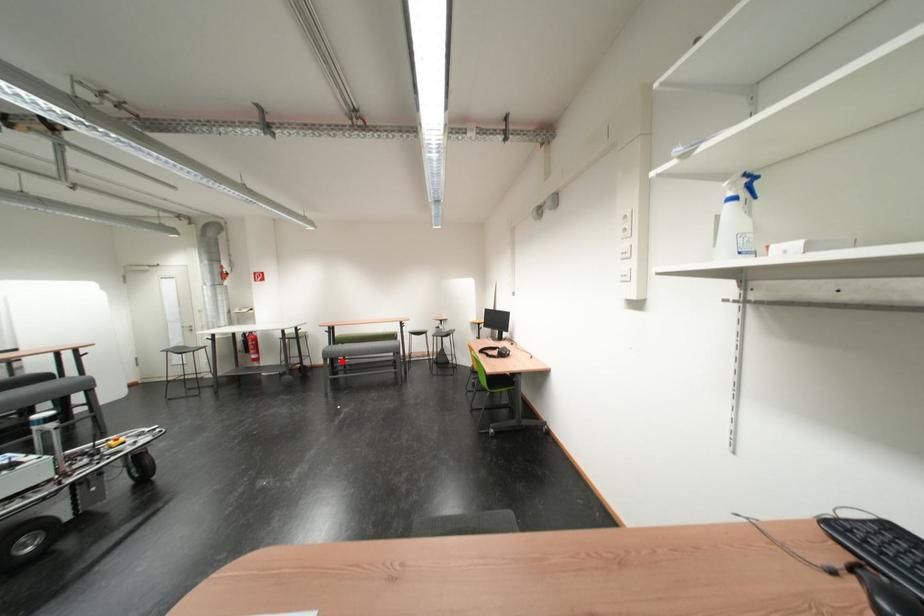
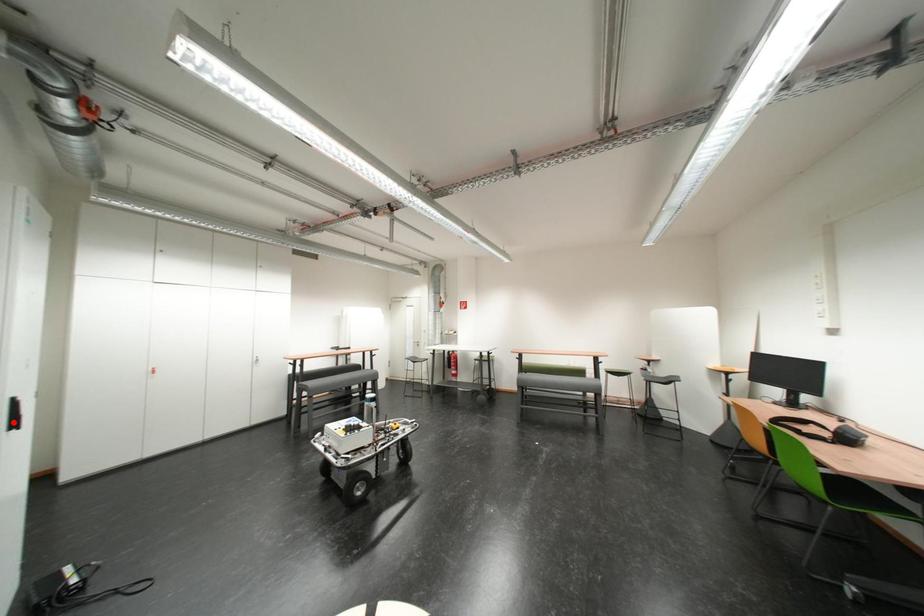
I am providing you with two images of the same scene from different viewpoints. A red point is marked on the first image and another point is marked on the second image. Is the red point in image1 aligned with the point shown in image2?

No